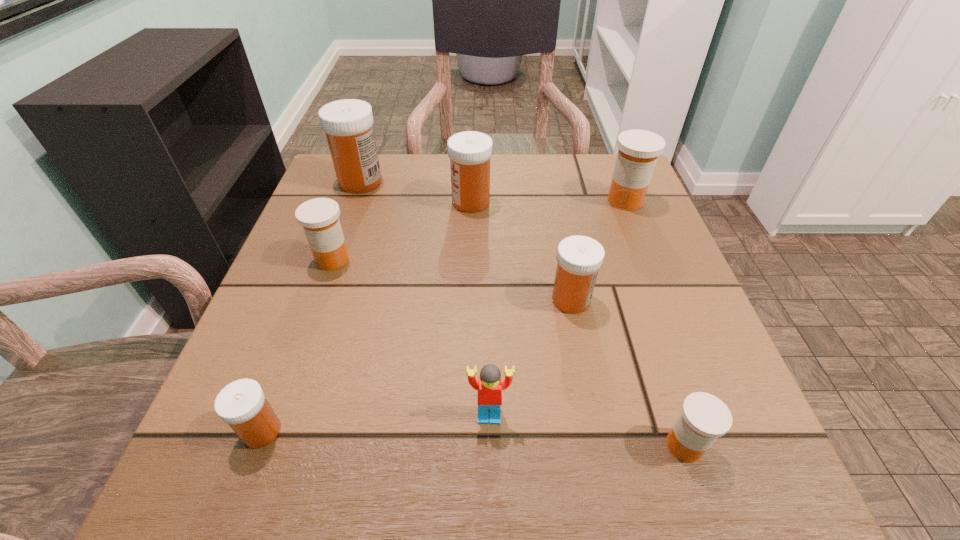
This screenshot has width=960, height=540. In order to click on vacant space at the far left corner of the desktop in this screenshot , I will do `click(357, 204)`.

This screenshot has width=960, height=540. Find the location of `vacant space at the far right corner`. vacant space at the far right corner is located at coordinates (584, 169).

Identify the location of unoccupied area between the smallest white medicine and the nearest orange medicine. (473, 438).

The image size is (960, 540). Identify the location of vacant space that's between the second farthest orange medicine and the Lego. (411, 338).

At what (x,y) coordinates should I click in order to perform the action: click on unoccupied position between the nearest white medicine and the Lego. Please return your answer as a coordinate pair (x, y). The height and width of the screenshot is (540, 960). Looking at the image, I should click on (375, 423).

This screenshot has height=540, width=960. Identify the location of free space that is in between the fourth nearest object and the Lego. (530, 357).

Where is `free space between the Lego and the fourth medicine from right to left`? free space between the Lego and the fourth medicine from right to left is located at coordinates click(x=480, y=309).

Identify the location of empty space between the third smallest white medicine and the farthest orange medicine. (548, 201).

Locate an element on the screen. This screenshot has height=540, width=960. free point between the nearest orange medicine and the farthest orange medicine is located at coordinates (655, 323).

Identify the location of free space between the smallest white medicine and the third medicine from right to left. (417, 366).